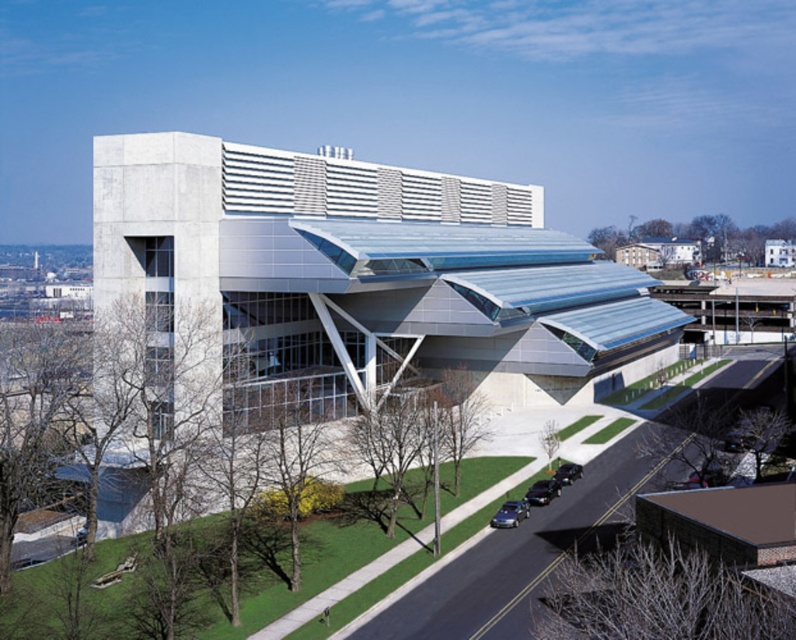
Question: Which of these objects is positioned farthest from the white metallic building at center?

Choices:
 (A) shiny blue sedan at lower center
 (B) shiny black car at lower center

Answer: (A)

Question: Is shiny blue sedan at lower center positioned before shiny black car at lower center?

Choices:
 (A) no
 (B) yes

Answer: (B)

Question: Does shiny blue sedan at lower center come in front of shiny black car at lower center?

Choices:
 (A) yes
 (B) no

Answer: (A)

Question: Estimate the real-world distances between objects in this image. Which object is farther from the white metallic building at center?

Choices:
 (A) shiny blue sedan at lower center
 (B) shiny black car at lower center

Answer: (A)

Question: Which of the following is the farthest from the observer?

Choices:
 (A) (564, 481)
 (B) (514, 500)

Answer: (A)

Question: Is shiny blue sedan at lower center smaller than shiny black sedan at lower center?

Choices:
 (A) no
 (B) yes

Answer: (A)